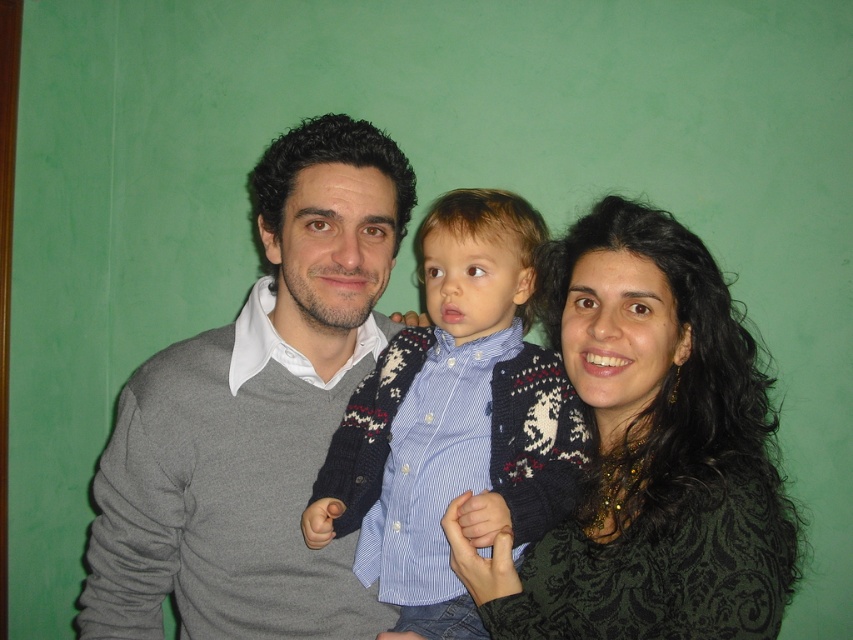
Question: Is black textured sweater at center to the right of knitted sweater at center from the viewer's perspective?

Choices:
 (A) no
 (B) yes

Answer: (B)

Question: Can you confirm if black textured sweater at center is positioned to the right of knitted sweater at center?

Choices:
 (A) no
 (B) yes

Answer: (B)

Question: Does gray sweater at center appear on the right side of knitted sweater at center?

Choices:
 (A) no
 (B) yes

Answer: (A)

Question: Estimate the real-world distances between objects in this image. Which object is closer to the blue striped shirt at center?

Choices:
 (A) knitted sweater at center
 (B) gray sweater at center
 (C) black textured sweater at center

Answer: (A)

Question: Which of the following is the farthest from the observer?

Choices:
 (A) (451, 202)
 (B) (384, 323)

Answer: (B)

Question: Which of these objects is positioned closest to the gray sweater at center?

Choices:
 (A) black textured sweater at center
 (B) knitted sweater at center

Answer: (B)